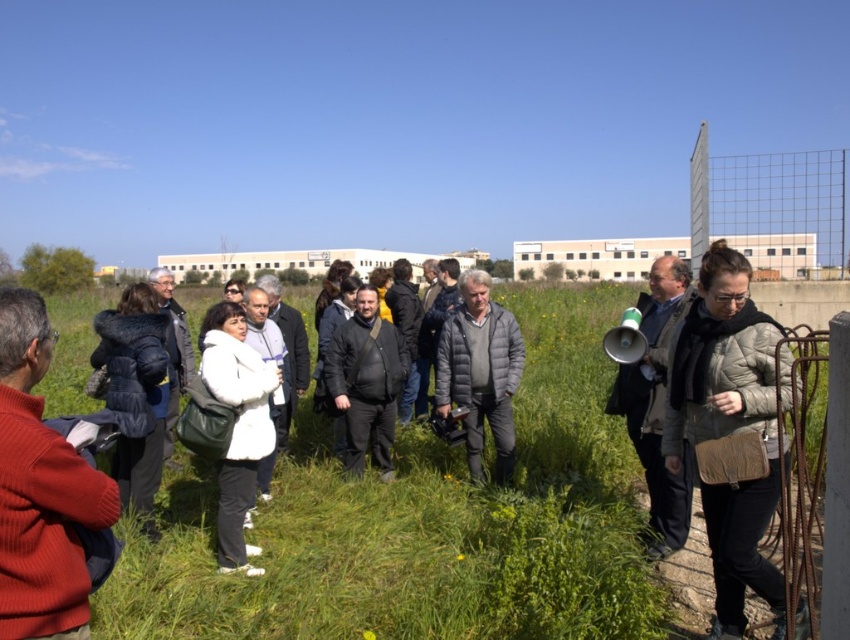
Looking at this image, you are standing at the point with coordinates point (480,372) in the image. What object are you currently standing on?

The point (480,372) is on the gray down jacket at center.

You are standing at the point marked by the coordinates point (731,428). Looking around, you see a matte beige jacket at lower right. Which direction should you walk to reach the person holding the megaphone?

The matte beige jacket at lower right is represented by point (731,428). To reach the person holding the megaphone, you should walk towards the center of the image where the group is gathered, as the megaphone holder is likely there facing the crowd.